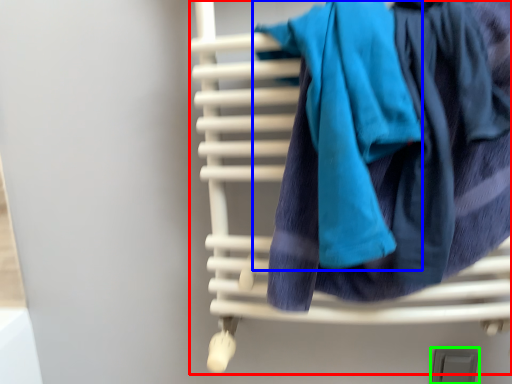
Question: Considering the real-world distances, which object is farthest from furniture (highlighted by a red box)? bath towel (highlighted by a blue box) or window (highlighted by a green box)?

Choices:
 (A) bath towel
 (B) window

Answer: (B)